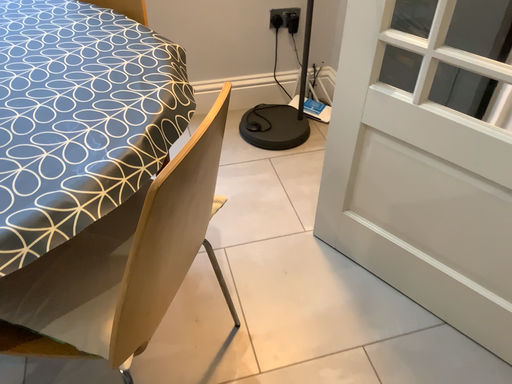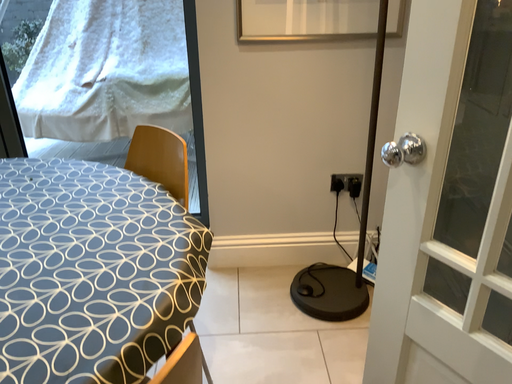
Question: How did the camera likely rotate when shooting the video?

Choices:
 (A) rotated right
 (B) rotated left

Answer: (B)